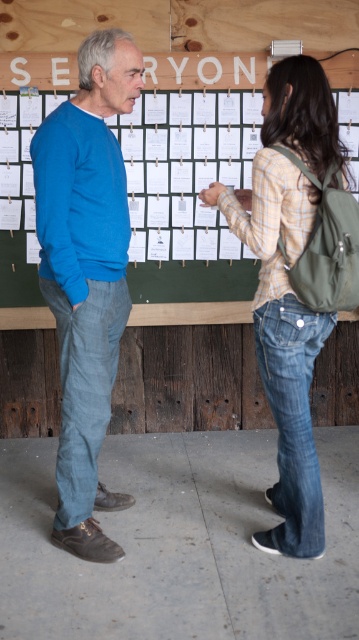
Question: Considering the relative positions of green fabric bulletin board at upper center and denim jeans at lower right in the image provided, where is green fabric bulletin board at upper center located with respect to denim jeans at lower right?

Choices:
 (A) right
 (B) left

Answer: (B)

Question: Estimate the real-world distances between objects in this image. Which object is closer to the denim jeans at center?

Choices:
 (A) denim jeans at lower right
 (B) blue cotton sweater at left
 (C) denim jeans at left
 (D) green fabric bulletin board at upper center

Answer: (A)

Question: Which point is farther from the camera taking this photo?

Choices:
 (A) [75, 444]
 (B) [21, 61]
 (C) [240, 196]
 (D) [95, 310]

Answer: (B)

Question: Is blue cotton sweater at left closer to camera compared to denim jeans at left?

Choices:
 (A) yes
 (B) no

Answer: (A)

Question: Does denim jeans at center have a greater width compared to denim jeans at lower right?

Choices:
 (A) yes
 (B) no

Answer: (A)

Question: Which of the following is the farthest from the observer?

Choices:
 (A) (10, 301)
 (B) (137, 54)

Answer: (A)